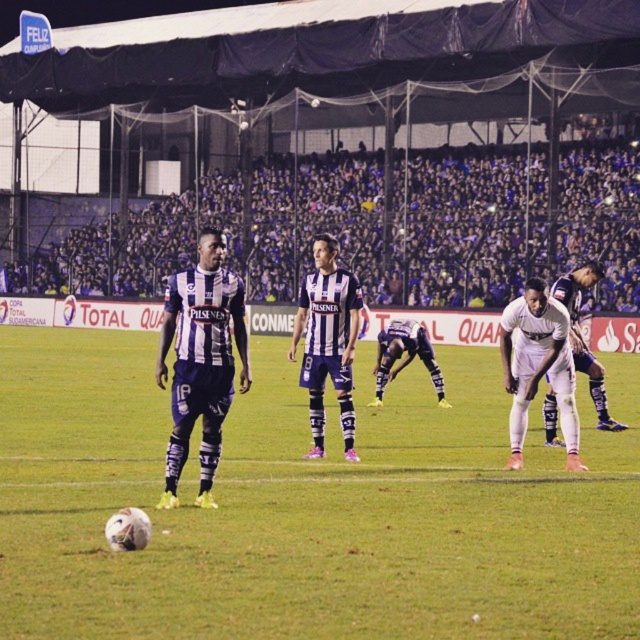
You are a drone operator trying to capture aerial footage of the soccer match. The green grass football field at center is represented by point (301,508). Can you confirm if this point is within the boundaries of the field?

The green grass football field at center is represented by point (301,508), so yes, the point is within the field boundaries.

You are a drone operator trying to capture aerial footage of the nighttime soccer match. The green grass football field at center and the striped jersey player at center are both in your camera view. Which object will appear larger in the camera frame?

The green grass football field at center will appear larger in the camera frame because it is much taller than the striped jersey player at center.

You are a photographer trying to capture a wide shot of the soccer match. You need to ensure both the green grass football field at center and the white matte uniform at center are fully visible in your frame. Which object should you focus on to ensure the entire width of both objects fits in the photo?

The green grass football field at center is wider than the white matte uniform at center. To ensure both are fully visible, focus on the wider object, the green grass football field at center, as it will require more space in the frame.